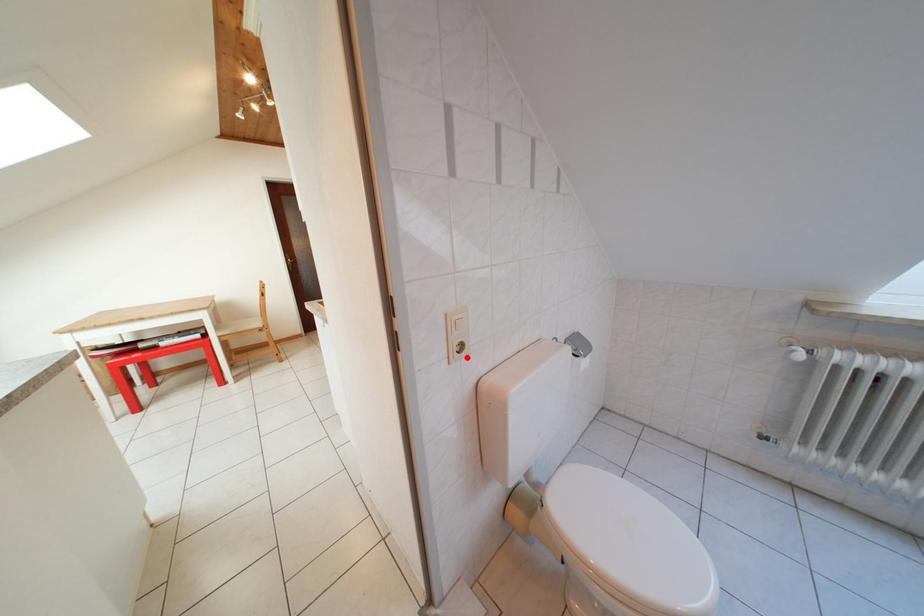
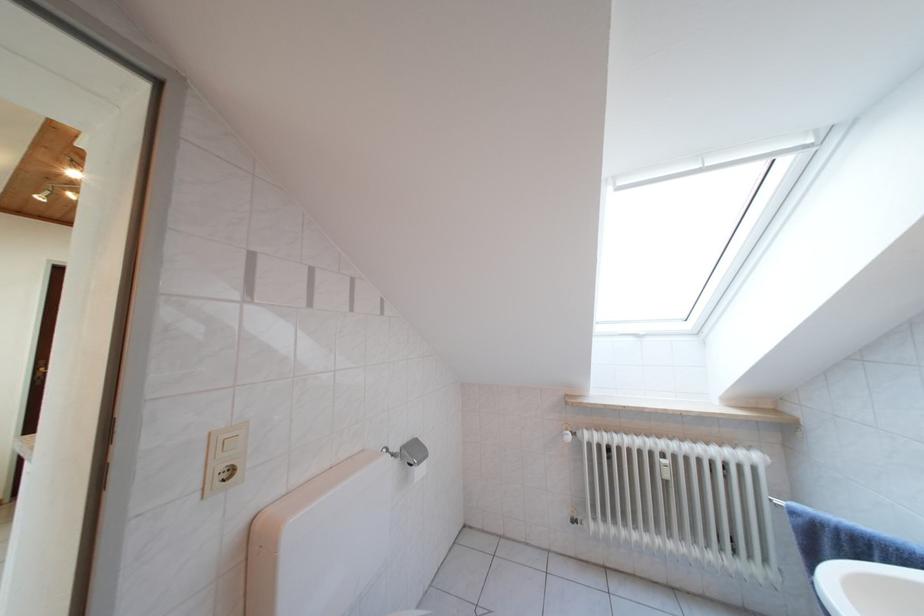
Find the pixel in the second image that matches the highlighted location in the first image.

(232, 485)